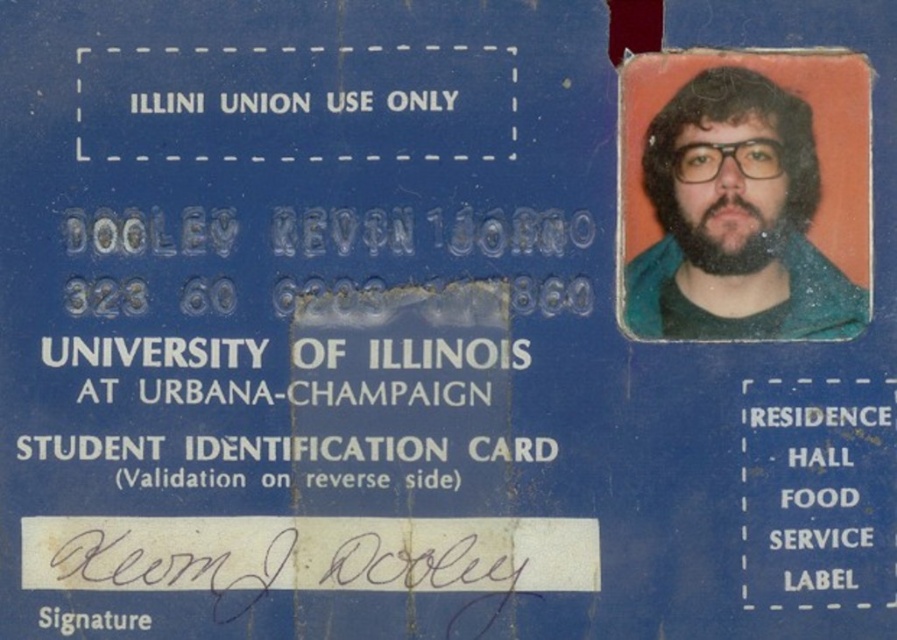
Question: Does green matte jacket at upper right lie behind dark brown thick beard at upper right?

Choices:
 (A) no
 (B) yes

Answer: (A)

Question: Does green matte jacket at upper right come behind dark brown thick beard at upper right?

Choices:
 (A) no
 (B) yes

Answer: (A)

Question: Which point appears closest to the camera in this image?

Choices:
 (A) (723, 147)
 (B) (685, 257)

Answer: (A)

Question: Which of the following is the farthest from the observer?

Choices:
 (A) green matte jacket at upper right
 (B) dark brown thick beard at upper right

Answer: (B)

Question: Is green matte jacket at upper right below dark brown thick beard at upper right?

Choices:
 (A) yes
 (B) no

Answer: (B)